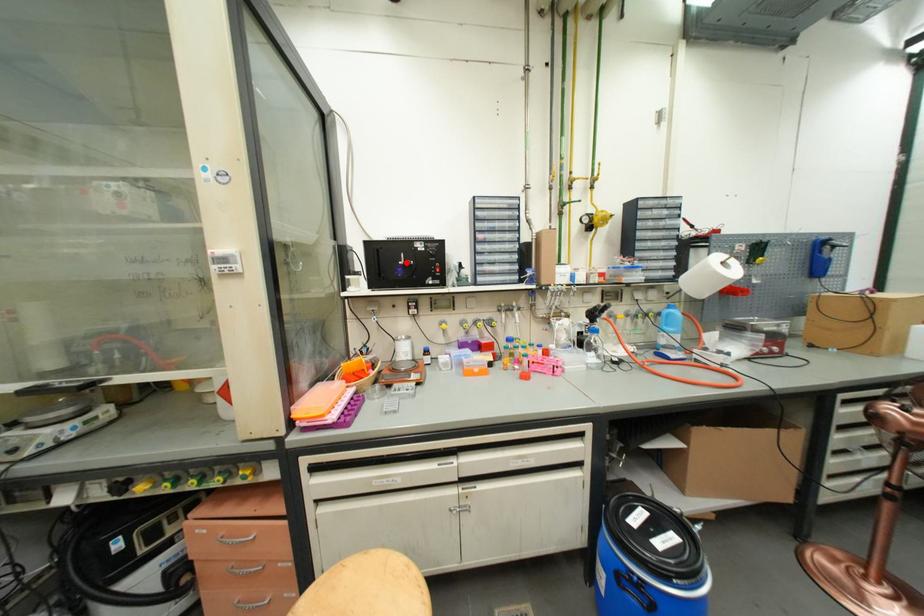
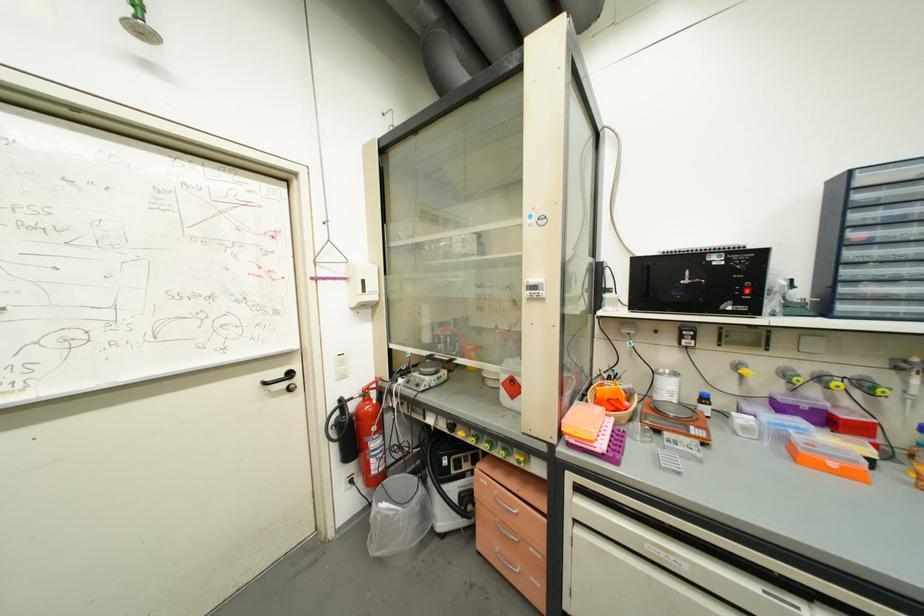
The point at the highlighted location is marked in the first image. Where is the corresponding point in the second image?

(688, 282)